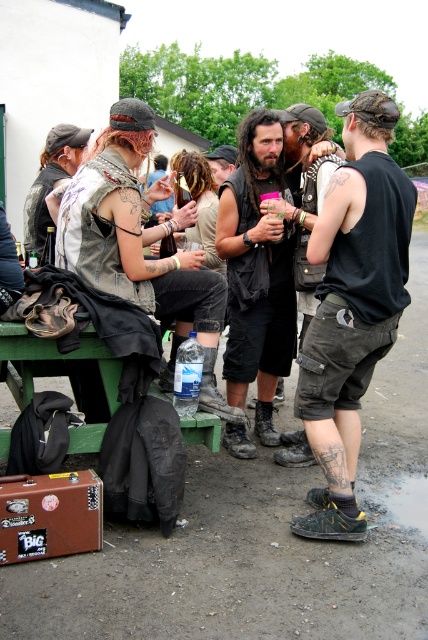
You are standing at a distance of 2.5 meters from the picnic table where the group is seated. Can you reach the point marked as point (371, 288) without moving closer than your current position?

The point (371, 288) is 2.70 meters away from the viewer. Since you are currently 2.5 meters away, you are already closer than the point, so you can reach it without moving closer.